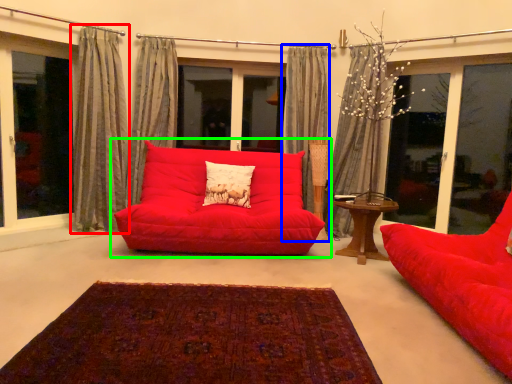
Question: Estimate the real-world distances between objects in this image. Which object is farther from curtain (highlighted by a red box), curtain (highlighted by a blue box) or studio couch (highlighted by a green box)?

Choices:
 (A) curtain
 (B) studio couch

Answer: (A)